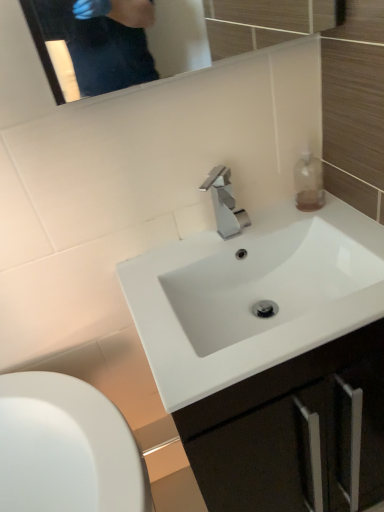
I want to click on free space between polished metallic faucet at center and translucent glass bottle at upper right, so click(x=273, y=219).